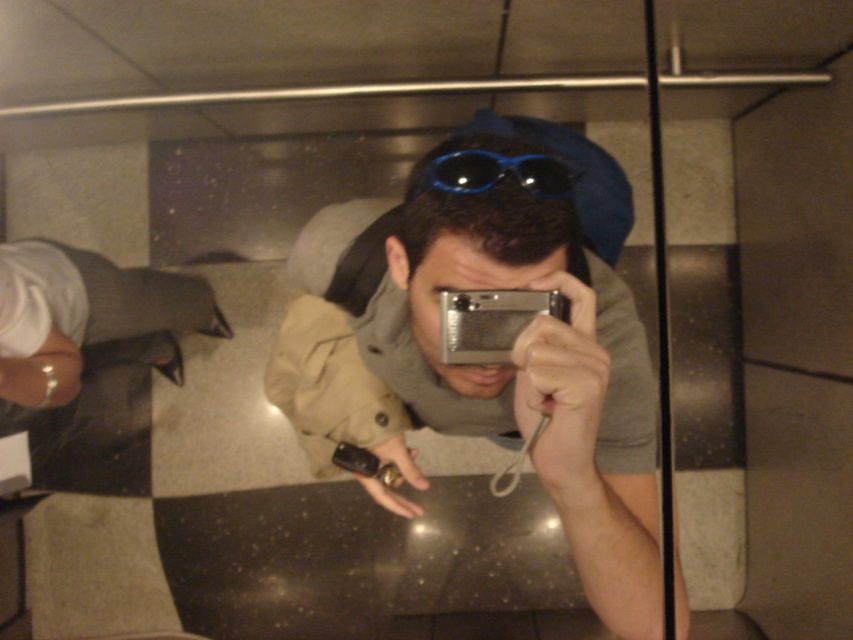
You are a photographer trying to capture a reflection in the mirror. You have a silver metallic camera at center and blue plastic goggles at center. Which object should you move to the left to frame the reflection better?

The silver metallic camera at center is positioned on the right side of blue plastic goggles at center. To frame the reflection better, move the silver metallic camera at center to the left so it aligns with the blue plastic goggles at center.

You are a photographer trying to capture the reflection in the mirror while holding the silver metallic camera at center and blue plastic goggles at center. Which object is taller when viewed from your perspective?

The silver metallic camera at center is taller than the blue plastic goggles at center according to the description.

You are a photographer trying to decide which item to use for a closeup shot. Given the silver metallic camera at center and the blue plastic goggles at center, which one is larger and more suitable for handling?

The silver metallic camera at center is bigger than the blue plastic goggles at center, making it more suitable for handling during a closeup shot.